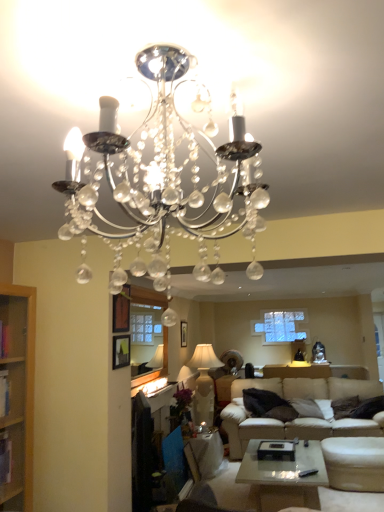
Question: From a real-world perspective, is white fabric lampshade at center, marked as the 1th lamp in a back-to-front arrangement, located beneath clear glass window screen at center?

Choices:
 (A) yes
 (B) no

Answer: (A)

Question: From the image's perspective, would you say white fabric lampshade at center, arranged as the 2th lamp when viewed from the top, is positioned over clear glass window screen at center?

Choices:
 (A) yes
 (B) no

Answer: (B)

Question: Is the position of white fabric lampshade at center, marked as the 1th lamp in a back-to-front arrangement, less distant than that of clear glass window screen at center?

Choices:
 (A) no
 (B) yes

Answer: (A)

Question: Can you confirm if white fabric lampshade at center, arranged as the 2th lamp when viewed from the top, is positioned to the right of clear glass window screen at center?

Choices:
 (A) yes
 (B) no

Answer: (A)

Question: Considering the relative positions of white fabric lampshade at center, marked as the 1th lamp in a back-to-front arrangement, and clear glass window screen at center in the image provided, is white fabric lampshade at center, marked as the 1th lamp in a back-to-front arrangement, to the left of clear glass window screen at center from the viewer's perspective?

Choices:
 (A) yes
 (B) no

Answer: (B)

Question: Visually, is white fabric lampshade at center, positioned as the 1th lamp in bottom-to-top order, positioned to the left or to the right of matte white side table at lower center?

Choices:
 (A) left
 (B) right

Answer: (B)

Question: From the image's perspective, is white fabric lampshade at center, marked as the 1th lamp in a back-to-front arrangement, above or below matte white side table at lower center?

Choices:
 (A) above
 (B) below

Answer: (A)

Question: Looking at their shapes, would you say white fabric lampshade at center, which is counted as the second lamp, starting from the front, is wider or thinner than matte white side table at lower center?

Choices:
 (A) thin
 (B) wide

Answer: (A)

Question: In the image, is white fabric lampshade at center, which is counted as the second lamp, starting from the front, positioned in front of or behind matte white side table at lower center?

Choices:
 (A) front
 (B) behind

Answer: (B)

Question: Is point (208, 471) closer or farther from the camera than point (196, 411)?

Choices:
 (A) farther
 (B) closer

Answer: (B)

Question: Visually, is matte white side table at lower center positioned to the left or to the right of white fabric lampshade at center, arranged as the 2th lamp when viewed from the top?

Choices:
 (A) right
 (B) left

Answer: (B)

Question: Choose the correct answer: Is matte white side table at lower center inside white fabric lampshade at center, which is counted as the second lamp, starting from the front, or outside it?

Choices:
 (A) inside
 (B) outside

Answer: (B)

Question: Is matte white side table at lower center taller or shorter than white fabric lampshade at center, positioned as the 1th lamp in bottom-to-top order?

Choices:
 (A) tall
 (B) short

Answer: (B)

Question: From the image's perspective, is clear glass window screen at center located above or below clear crystal chandelier at upper center, the second lamp from the bottom?

Choices:
 (A) above
 (B) below

Answer: (B)

Question: From a real-world perspective, is clear glass window screen at center above or below clear crystal chandelier at upper center, positioned as the first lamp in front-to-back order?

Choices:
 (A) above
 (B) below

Answer: (B)